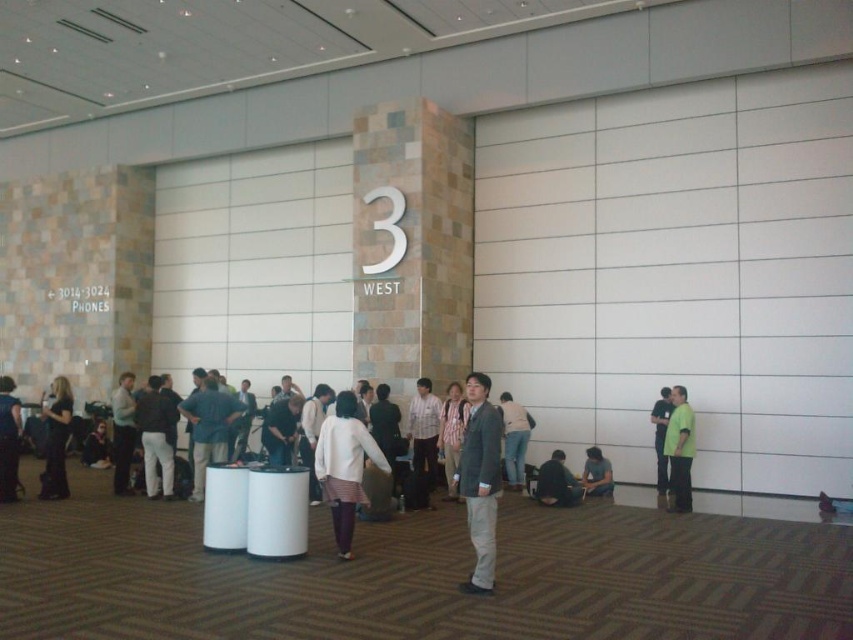
You are at an event and want to check if the jeans at center is covering the matte black jacket at lower left. Can you confirm?

The jeans at center is positioned over the matte black jacket at lower left, so yes, the jeans at center is covering the matte black jacket at lower left.

You are at the conference hall and want to take a photo of the jeans at center without the matte black jacket at lower left appearing in the background. Is this possible based on their positions?

The jeans at center is in front of the matte black jacket at lower left, so if you position yourself so that the jeans blocks the view of the jacket, you can take the photo without the jacket appearing in the background.

You are at the event and see two people in the foreground. One is wearing a plaid shirt at center and the other a matte gray shirt at lower center. From your perspective, which person is positioned more to the left?

The plaid shirt at center is positioned to the left of the matte gray shirt at lower center, so the person in the plaid shirt at center is more to the left.